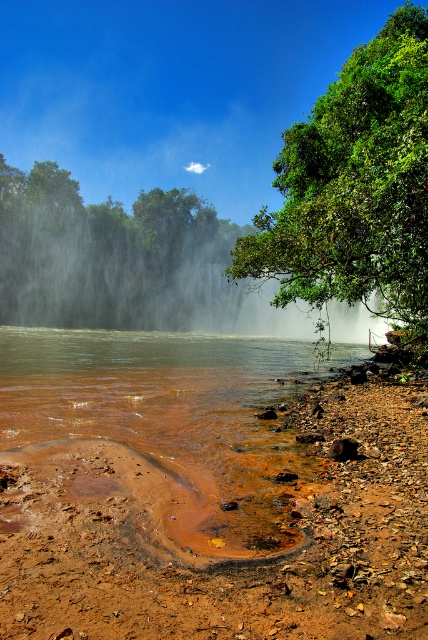
You are standing at the edge of the water in the scene. There is a point marked at coordinates (148, 148). What is located at that point?

The point at coordinates (148, 148) marks white mist at center.

You are standing on the rocky shore near the brown muddy water at lower left and want to walk towards the white mist at center. Which direction should you head?

You should head to the right side because the white mist at center is positioned on the left side of brown muddy water at lower left, meaning it is located to the right from your current position.